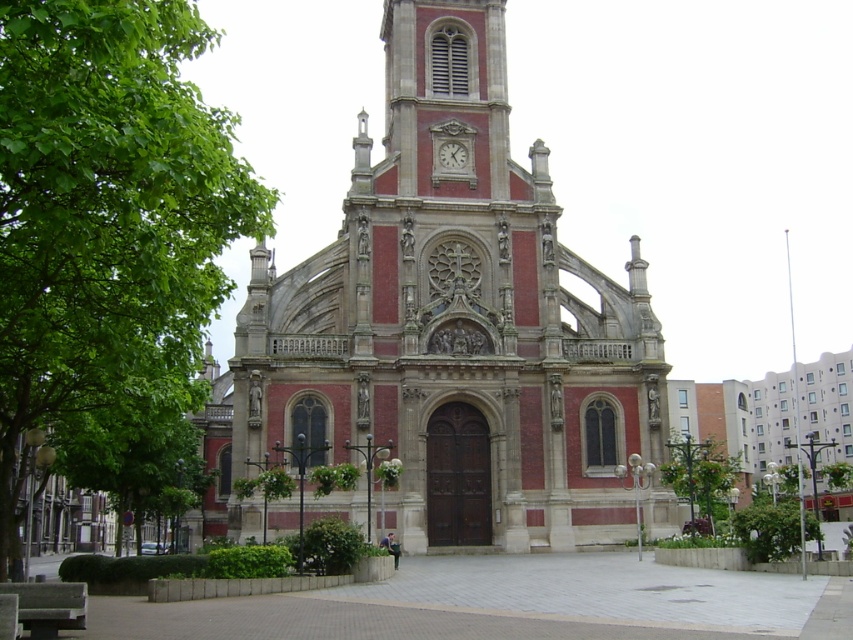
You are standing at the center of a square in front of the red brick church at center. If you face directly towards the church, which direction should you turn to find the rose window above the entrance?

The red brick church at center has its rose window above the entrance, which is located at its central front. Since you are facing the church directly, the rose window would be straight ahead, requiring no turn. However, if the rose window is part of the central facade, you would not need to turn left or right. But according to the scene description, the rose window is above the entrance, so facing the church directly means the rose window is in front of you. Therefore, you don not need to turn left or turn